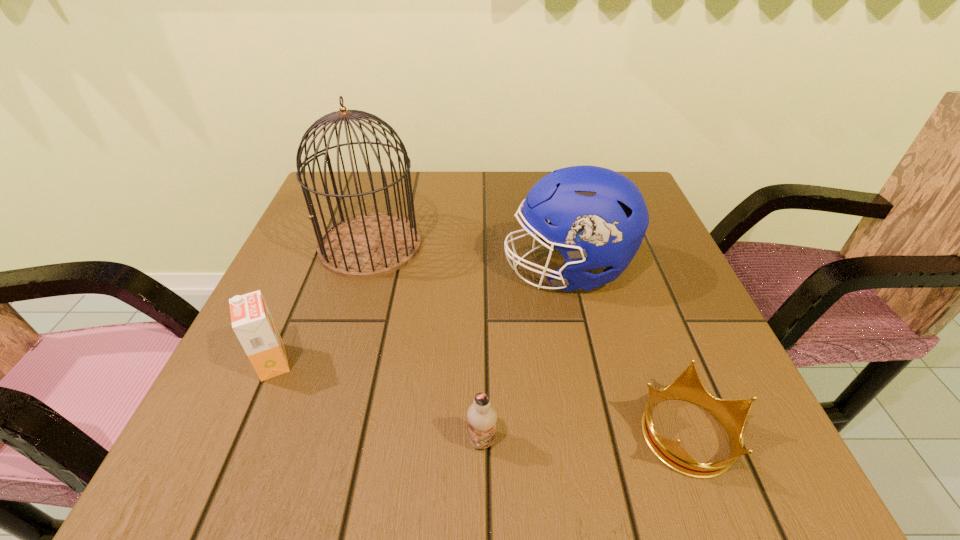
Locate an element on the screen. The width and height of the screenshot is (960, 540). free space in the image that satisfies the following two spatial constraints: 1. on the front-facing side of the football helmet; 2. on the right side of the crown is located at coordinates pyautogui.click(x=603, y=433).

Find the location of `free region that satisfies the following two spatial constraints: 1. on the front side of the third farthest object; 2. on the left side of the crown`. free region that satisfies the following two spatial constraints: 1. on the front side of the third farthest object; 2. on the left side of the crown is located at coordinates (x=243, y=433).

The width and height of the screenshot is (960, 540). I want to click on free region that satisfies the following two spatial constraints: 1. on the front side of the orange juice; 2. on the right side of the crown, so click(243, 433).

Image resolution: width=960 pixels, height=540 pixels. In order to click on vacant space that satisfies the following two spatial constraints: 1. on the front-facing side of the fourth shortest object; 2. on the front side of the chocolate milk in this screenshot , I will do `click(605, 441)`.

Find the location of a particular element. Image resolution: width=960 pixels, height=540 pixels. vacant space that satisfies the following two spatial constraints: 1. at the door of the shortest object; 2. on the right side of the birdcage is located at coordinates (314, 433).

The width and height of the screenshot is (960, 540). Find the location of `blank space that satisfies the following two spatial constraints: 1. on the front-facing side of the shortest object; 2. on the right side of the football helmet`. blank space that satisfies the following two spatial constraints: 1. on the front-facing side of the shortest object; 2. on the right side of the football helmet is located at coordinates (603, 433).

Find the location of a particular element. The width and height of the screenshot is (960, 540). vacant space that satisfies the following two spatial constraints: 1. at the door of the tallest object; 2. on the right side of the shortest object is located at coordinates (314, 433).